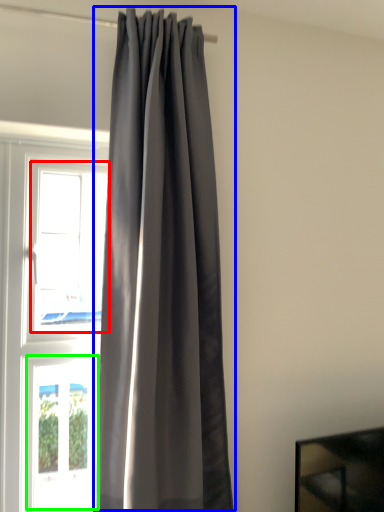
Question: Which is farther away from window (highlighted by a red box)? curtain (highlighted by a blue box) or window (highlighted by a green box)?

Choices:
 (A) curtain
 (B) window

Answer: (B)